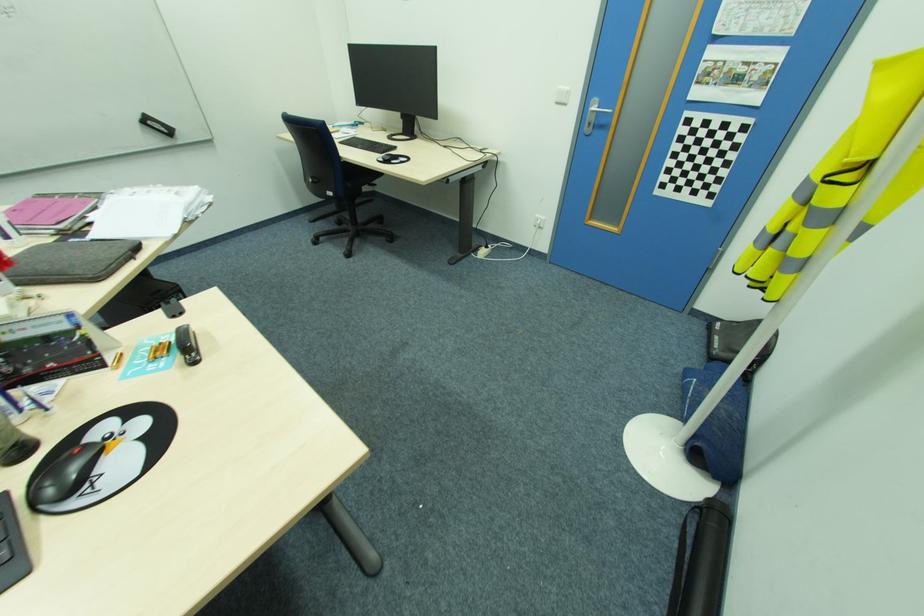
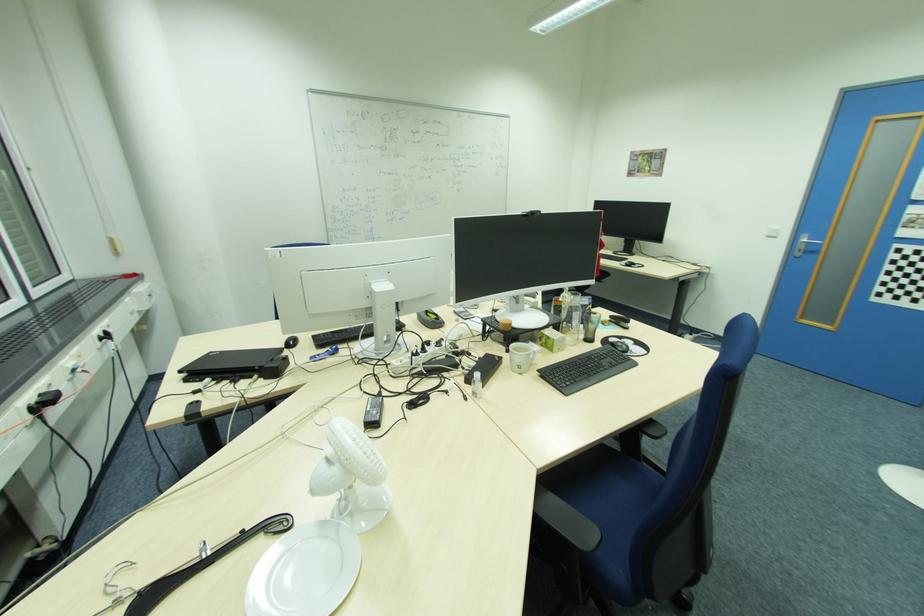
Question: I am providing you with two images of the same scene from different viewpoints. Which of the following objects are not visible in image2?

Choices:
 (A) chair sitting surface
 (B) hand sanitizer bottle
 (C) black computer mouse
 (D) none of these

Answer: (D)